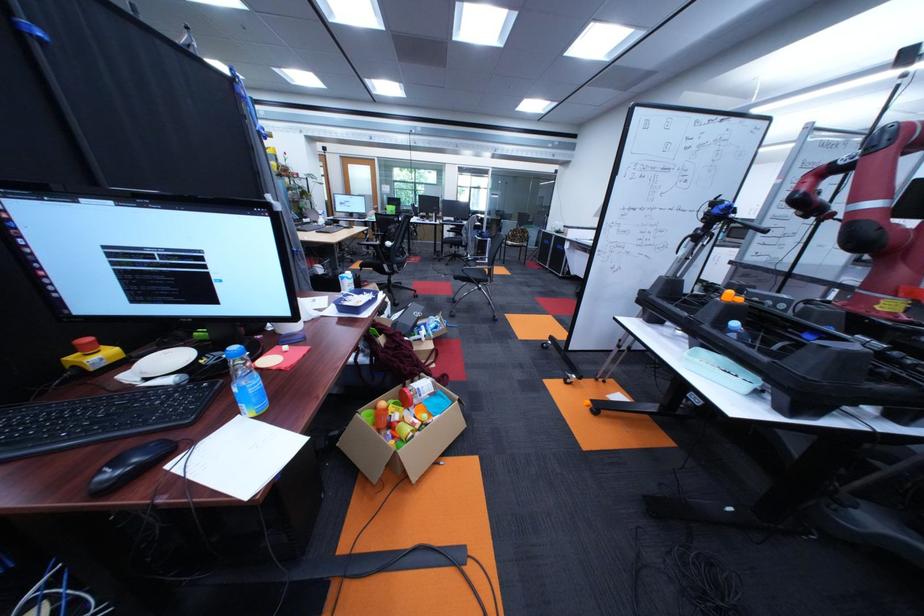
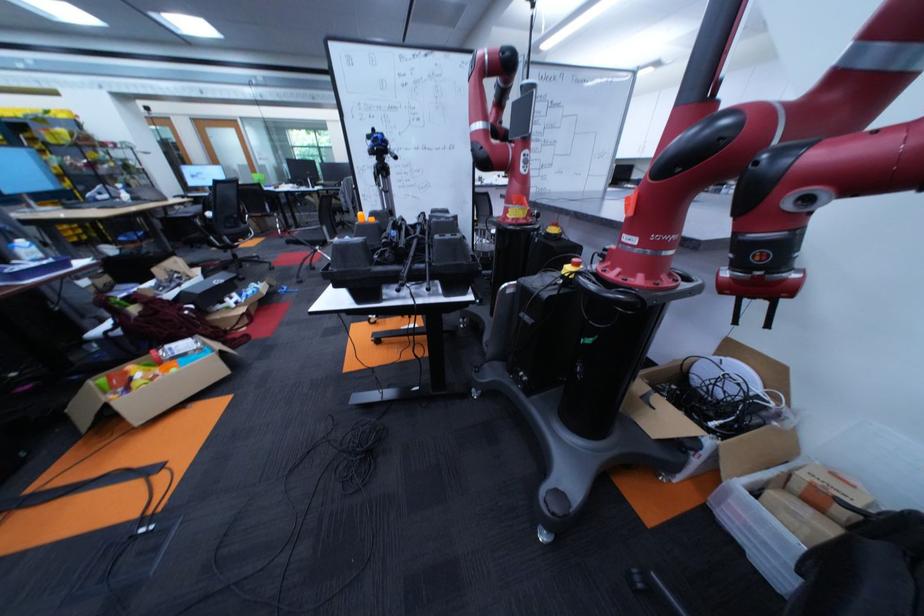
In the second image, find the point that corresponds to pixel 402 245 in the first image.

(224, 215)